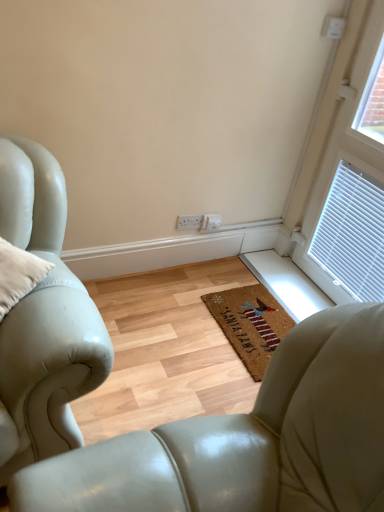
Question: Is coir mat at center surrounded by white plastic window at upper right?

Choices:
 (A) no
 (B) yes

Answer: (A)

Question: Is white plastic window at upper right not inside coir mat at center?

Choices:
 (A) no
 (B) yes

Answer: (B)

Question: Is white plastic window at upper right further to the viewer compared to coir mat at center?

Choices:
 (A) no
 (B) yes

Answer: (A)

Question: From the image's perspective, is white plastic window at upper right above coir mat at center?

Choices:
 (A) no
 (B) yes

Answer: (B)

Question: Is white plastic window at upper right oriented away from coir mat at center?

Choices:
 (A) no
 (B) yes

Answer: (A)

Question: In the image, is coir mat at center positioned in front of or behind leather armchair at center?

Choices:
 (A) front
 (B) behind

Answer: (B)

Question: Is coir mat at center taller or shorter than leather armchair at center?

Choices:
 (A) tall
 (B) short

Answer: (B)

Question: Considering the positions of coir mat at center and leather armchair at center in the image, is coir mat at center wider or thinner than leather armchair at center?

Choices:
 (A) wide
 (B) thin

Answer: (B)

Question: Considering the positions of coir mat at center and leather armchair at center in the image, is coir mat at center bigger or smaller than leather armchair at center?

Choices:
 (A) big
 (B) small

Answer: (B)

Question: Considering the positions of point (319, 215) and point (266, 466), is point (319, 215) closer or farther from the camera than point (266, 466)?

Choices:
 (A) farther
 (B) closer

Answer: (A)

Question: Based on their sizes in the image, would you say white plastic window at upper right is bigger or smaller than leather armchair at center?

Choices:
 (A) big
 (B) small

Answer: (A)

Question: In terms of height, does white plastic window at upper right look taller or shorter compared to leather armchair at center?

Choices:
 (A) short
 (B) tall

Answer: (B)

Question: Is white plastic window at upper right to the left or to the right of leather armchair at center in the image?

Choices:
 (A) right
 (B) left

Answer: (A)

Question: Is leather armchair at center spatially inside white plastic window at upper right, or outside of it?

Choices:
 (A) outside
 (B) inside

Answer: (A)

Question: In terms of width, does leather armchair at center look wider or thinner when compared to white plastic window at upper right?

Choices:
 (A) thin
 (B) wide

Answer: (B)